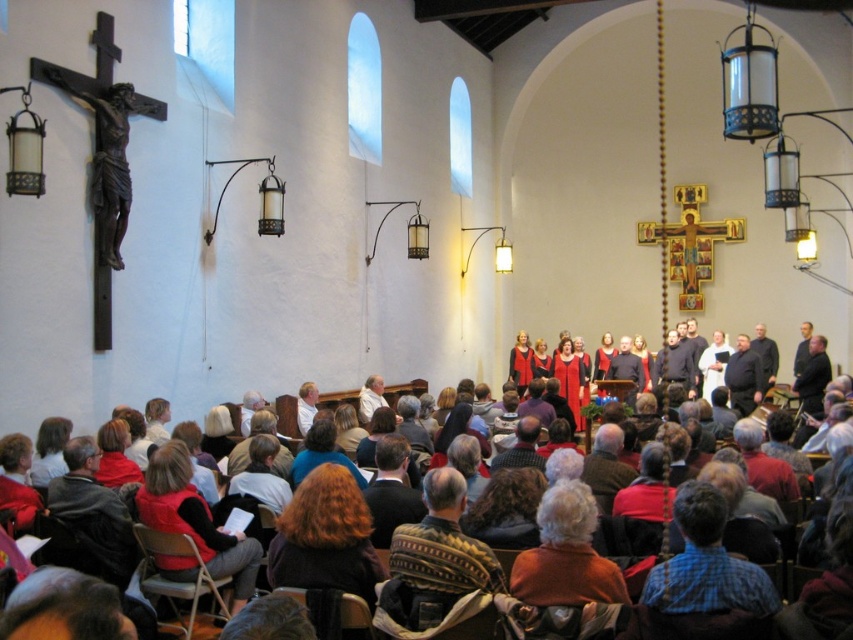
You are a photographer standing in the church and want to take a photo that includes both the wooden crucifix at left and the red velvet dress at center. Given that your camera has a maximum focus range of 15 meters, will you be able to capture both subjects in focus without moving your position?

The wooden crucifix at left and red velvet dress at center are 18.17 meters apart, which exceeds the camera maximum focus range of 15 meters. Therefore, you cannot capture both subjects in focus without moving your position.

Based on the photo, you are an usher at the church and need to guide a guest to the front pew. The guest asks if they can see the wooden crucifix at left from where they are standing in the red velvet dress at center. Can they see it?

The red velvet dress at center is behind the wooden crucifix at left, so the guest standing there would be behind the crucifix. This means the crucifix would block their view of it from that position.